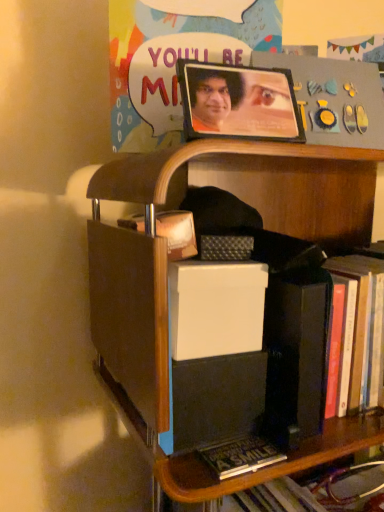
Describe the element at coordinates (253, 202) in the screenshot. I see `wooden shelf at center` at that location.

The image size is (384, 512). What are the coordinates of `wooden shelf at center` in the screenshot? It's located at (253, 202).

Identify the location of wooden picture frame at upper center. This screenshot has width=384, height=512. (238, 102).

From the image's perspective, is wooden picture frame at upper center on top of wooden shelf at center?

Yes.

Between wooden picture frame at upper center and wooden shelf at center, which one has larger width?

wooden shelf at center is wider.

Considering the positions of objects wooden picture frame at upper center and wooden shelf at center in the image provided, who is more to the left, wooden picture frame at upper center or wooden shelf at center?

wooden picture frame at upper center is more to the left.

From a real-world perspective, between wooden picture frame at upper center and wooden shelf at center, who is vertically higher?

In real-world perspective, wooden picture frame at upper center is above.

Is matte plastic poster at upper center not close to wooden shelf at center?

No, matte plastic poster at upper center is not far from wooden shelf at center.

Is wooden shelf at center a part of matte plastic poster at upper center?

No, wooden shelf at center is not a part of matte plastic poster at upper center.

Which object is closer to the camera, matte plastic poster at upper center or wooden shelf at center?

wooden shelf at center is in front.

Is matte plastic poster at upper center facing away from wooden shelf at center?

No, matte plastic poster at upper center's orientation is not away from wooden shelf at center.

Does wooden picture frame at upper center have a lesser width compared to matte plastic poster at upper center?

No.

Considering the positions of objects wooden picture frame at upper center and matte plastic poster at upper center in the image provided, who is in front, wooden picture frame at upper center or matte plastic poster at upper center?

wooden picture frame at upper center is closer to the camera.

From a real-world perspective, is wooden picture frame at upper center physically above matte plastic poster at upper center?

No, from a real-world perspective, wooden picture frame at upper center is not above matte plastic poster at upper center.

Does wooden shelf at center come behind matte plastic poster at upper center?

No, the depth of wooden shelf at center is less than that of matte plastic poster at upper center.

Which object is positioned more to the right, wooden shelf at center or matte plastic poster at upper center?

Positioned to the right is wooden shelf at center.

From their relative heights in the image, would you say wooden shelf at center is taller or shorter than matte plastic poster at upper center?

In the image, wooden shelf at center appears to be taller than matte plastic poster at upper center.

Is matte plastic poster at upper center with wooden picture frame at upper center?

Yes, the surface of matte plastic poster at upper center is in contact with wooden picture frame at upper center.

Is matte plastic poster at upper center oriented towards wooden picture frame at upper center?

Yes, matte plastic poster at upper center is facing wooden picture frame at upper center.

Based on the photo, is matte plastic poster at upper center bigger than wooden picture frame at upper center?

Yes, matte plastic poster at upper center is bigger than wooden picture frame at upper center.

Where is `picture frame directly beneath the matte plastic poster at upper center (from a real-world perspective)`? picture frame directly beneath the matte plastic poster at upper center (from a real-world perspective) is located at coordinates (238, 102).

From the picture: Between wooden shelf at center and wooden picture frame at upper center, which one has less height?

wooden picture frame at upper center is shorter.

From the picture: Is wooden shelf at center aimed at wooden picture frame at upper center?

No, wooden shelf at center is not turned towards wooden picture frame at upper center.

Consider the image. Which is behind, wooden shelf at center or wooden picture frame at upper center?

wooden picture frame at upper center is further away from the camera.

Find the location of `picture frame above the wooden shelf at center (from a real-world perspective)`. picture frame above the wooden shelf at center (from a real-world perspective) is located at coordinates (238, 102).

This screenshot has height=512, width=384. What are the coordinates of `picture frame above the wooden shelf at center (from a real-world perspective)` in the screenshot? It's located at (238, 102).

The width and height of the screenshot is (384, 512). I want to click on shelf on the right side of matte plastic poster at upper center, so click(253, 202).

From the image, which object appears to be farther from wooden shelf at center, wooden picture frame at upper center or matte plastic poster at upper center?

The object further to wooden shelf at center is matte plastic poster at upper center.

Consider the image. Based on their spatial positions, is wooden shelf at center or matte plastic poster at upper center further from wooden picture frame at upper center?

The object further to wooden picture frame at upper center is wooden shelf at center.

Based on the photo, which object lies nearer to the anchor point matte plastic poster at upper center, wooden shelf at center or wooden picture frame at upper center?

wooden picture frame at upper center lies closer to matte plastic poster at upper center than the other object.

Considering their positions, is matte plastic poster at upper center positioned further to wooden shelf at center than wooden picture frame at upper center?

The object further to wooden shelf at center is matte plastic poster at upper center.

When comparing their distances from matte plastic poster at upper center, does wooden picture frame at upper center or wooden shelf at center seem further?

wooden shelf at center.

Looking at this image, which object lies further to the anchor point wooden picture frame at upper center, matte plastic poster at upper center or wooden shelf at center?

Among the two, wooden shelf at center is located further to wooden picture frame at upper center.

Where is `picture frame that lies between matte plastic poster at upper center and wooden shelf at center from top to bottom`? The image size is (384, 512). picture frame that lies between matte plastic poster at upper center and wooden shelf at center from top to bottom is located at coordinates (238, 102).